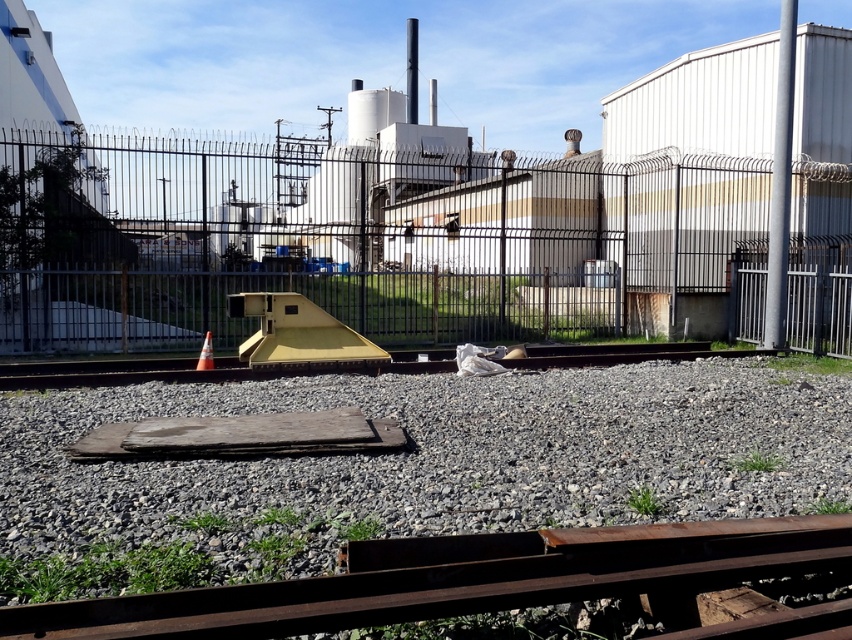
Can you confirm if metallic wire mesh fence at center is thinner than orange reflective cone at center?

In fact, metallic wire mesh fence at center might be wider than orange reflective cone at center.

Can you confirm if metallic wire mesh fence at center is wider than orange reflective cone at center?

Correct, the width of metallic wire mesh fence at center exceeds that of orange reflective cone at center.

Describe the element at coordinates (357, 237) in the screenshot. I see `metallic wire mesh fence at center` at that location.

This screenshot has width=852, height=640. I want to click on metallic wire mesh fence at center, so click(357, 237).

Is the position of rusty metal train track at lower center more distant than that of orange reflective cone at center?

No.

Can you confirm if rusty metal train track at lower center is smaller than orange reflective cone at center?

No.

What are the coordinates of `rusty metal train track at lower center` in the screenshot? It's located at (463, 579).

Identify the location of rusty metal train track at lower center. (463, 579).

How far apart are metallic wire mesh fence at center and rusty metal train track at lower center?

metallic wire mesh fence at center is 62.27 feet away from rusty metal train track at lower center.

Where is `metallic wire mesh fence at center`? The image size is (852, 640). metallic wire mesh fence at center is located at coordinates (357, 237).